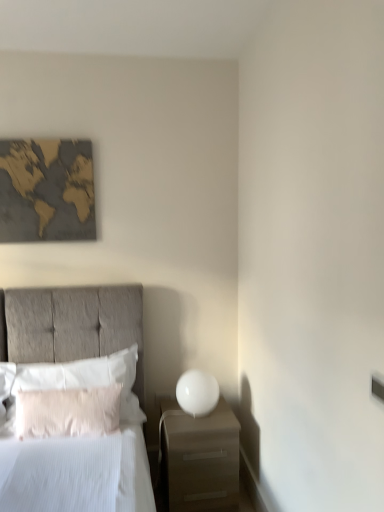
Question: Does white glossy sphere at right come behind gold textured map at upper left?

Choices:
 (A) yes
 (B) no

Answer: (B)

Question: Considering the relative sizes of white glossy sphere at right and gold textured map at upper left in the image provided, is white glossy sphere at right wider than gold textured map at upper left?

Choices:
 (A) no
 (B) yes

Answer: (B)

Question: Is white glossy sphere at right turned away from gold textured map at upper left?

Choices:
 (A) yes
 (B) no

Answer: (B)

Question: Is the position of white glossy sphere at right less distant than that of gold textured map at upper left?

Choices:
 (A) yes
 (B) no

Answer: (A)

Question: From the image's perspective, is white glossy sphere at right beneath gold textured map at upper left?

Choices:
 (A) no
 (B) yes

Answer: (B)

Question: From a real-world perspective, relative to matte gray bed at left, is matte white nightstand at lower right vertically above or below?

Choices:
 (A) below
 (B) above

Answer: (A)

Question: In terms of size, does matte white nightstand at lower right appear bigger or smaller than matte gray bed at left?

Choices:
 (A) big
 (B) small

Answer: (B)

Question: Is point (213, 508) closer or farther from the camera than point (117, 325)?

Choices:
 (A) farther
 (B) closer

Answer: (B)

Question: Would you say matte white nightstand at lower right is to the left or to the right of matte gray bed at left in the picture?

Choices:
 (A) left
 (B) right

Answer: (B)

Question: Is gold textured map at upper left wider or thinner than white fluffy pillow at left, which appears as the 2th pillow when viewed from the back?

Choices:
 (A) wide
 (B) thin

Answer: (B)

Question: Considering the positions of gold textured map at upper left and white fluffy pillow at left, which appears as the 2th pillow when viewed from the back, in the image, is gold textured map at upper left bigger or smaller than white fluffy pillow at left, which appears as the 2th pillow when viewed from the back,?

Choices:
 (A) small
 (B) big

Answer: (A)

Question: In the image, is gold textured map at upper left positioned in front of or behind white fluffy pillow at left, acting as the 1th pillow starting from the front?

Choices:
 (A) behind
 (B) front

Answer: (A)

Question: Is gold textured map at upper left to the left or to the right of white fluffy pillow at left, which appears as the 2th pillow when viewed from the back, in the image?

Choices:
 (A) left
 (B) right

Answer: (A)

Question: Choose the correct answer: Is white fluffy pillow at left, acting as the 1th pillow starting from the front, inside white soft pillow at left, the 1th pillow from the back, or outside it?

Choices:
 (A) outside
 (B) inside

Answer: (A)

Question: Based on their sizes in the image, would you say white fluffy pillow at left, which appears as the 2th pillow when viewed from the back, is bigger or smaller than white soft pillow at left, the 1th pillow from the back?

Choices:
 (A) small
 (B) big

Answer: (A)